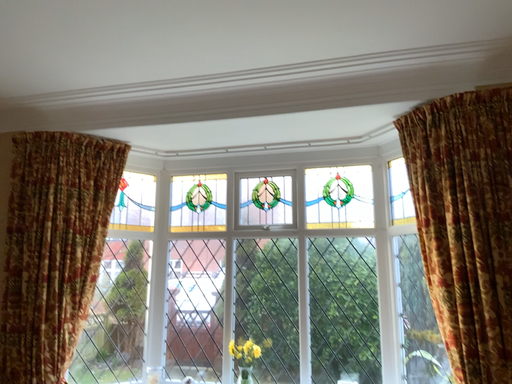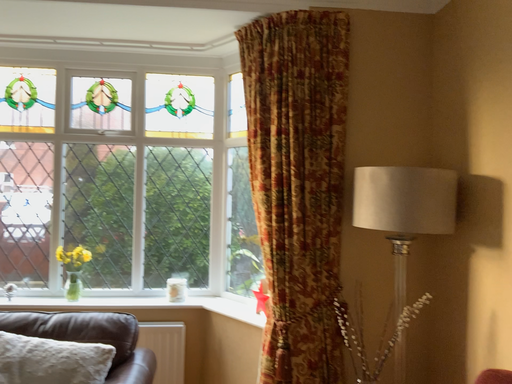
Question: How did the camera likely rotate when shooting the video?

Choices:
 (A) rotated right
 (B) rotated left

Answer: (A)